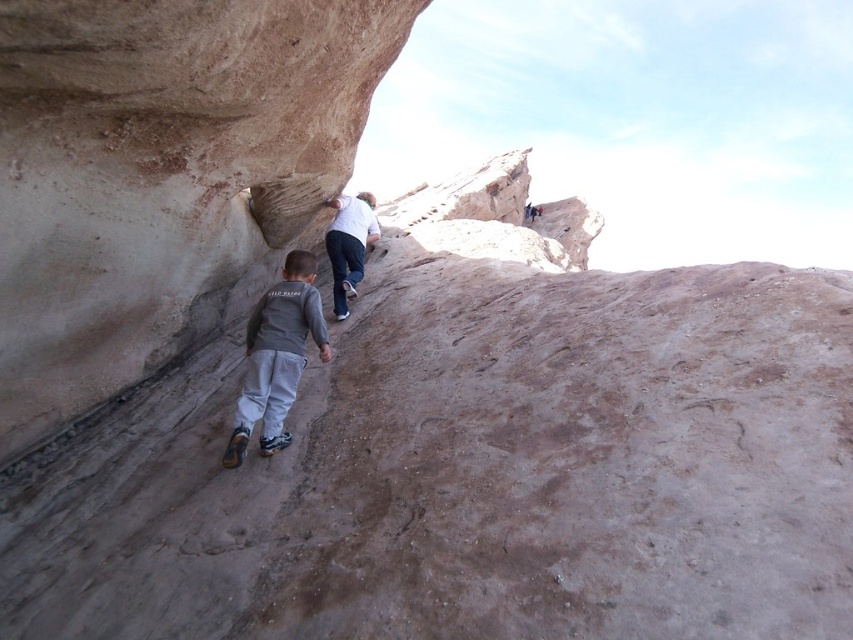
Question: Which object is farther from the camera taking this photo?

Choices:
 (A) white matte shirt at upper center
 (B) gray fabric pants at lower center
 (C) smooth beige rock at center

Answer: (A)

Question: Does smooth beige rock at center appear on the left side of gray fabric pants at lower center?

Choices:
 (A) no
 (B) yes

Answer: (B)

Question: Is smooth beige rock at center closer to the viewer compared to gray fabric pants at lower center?

Choices:
 (A) no
 (B) yes

Answer: (B)

Question: Which object appears farthest from the camera in this image?

Choices:
 (A) smooth beige rock at center
 (B) white matte shirt at upper center

Answer: (B)

Question: Estimate the real-world distances between objects in this image. Which object is farther from the white matte shirt at upper center?

Choices:
 (A) gray fabric pants at lower center
 (B) smooth beige rock at center

Answer: (A)

Question: Is smooth beige rock at center smaller than white matte shirt at upper center?

Choices:
 (A) no
 (B) yes

Answer: (A)